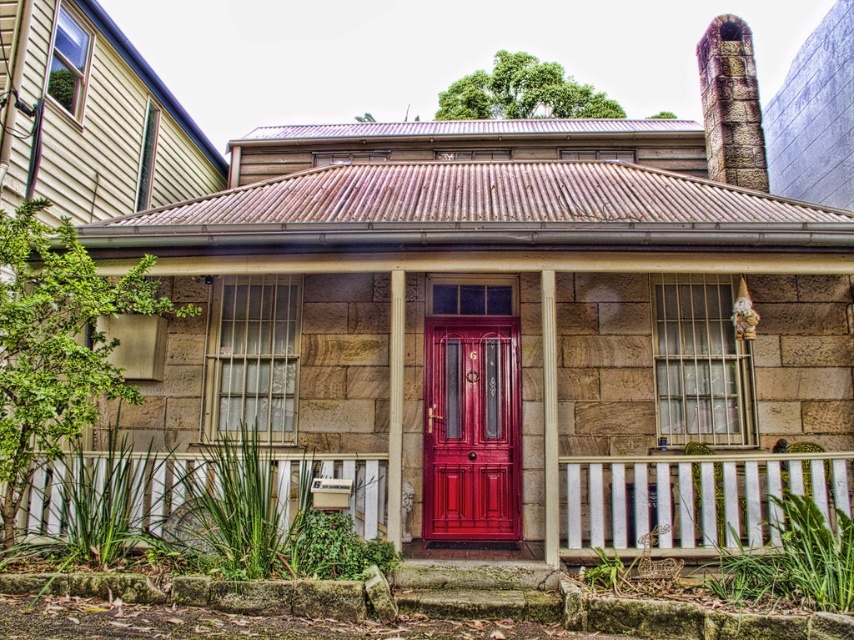
Between point (563, 525) and point (483, 324), which one is positioned in front?

Point (563, 525)

Is smooth wooden porch at center to the left of glossy wood door at center from the viewer's perspective?

No, smooth wooden porch at center is not to the left of glossy wood door at center.

Image resolution: width=854 pixels, height=640 pixels. What do you see at coordinates (693, 499) in the screenshot? I see `smooth wooden porch at center` at bounding box center [693, 499].

Locate an element on the screen. This screenshot has height=640, width=854. smooth wooden porch at center is located at coordinates (693, 499).